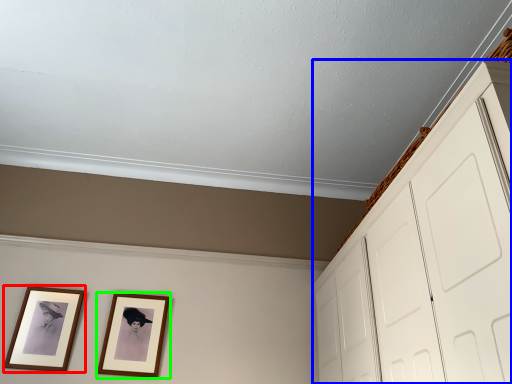
Question: Based on their relative distances, which object is farther from picture frame (highlighted by a red box)? Choose from dresser (highlighted by a blue box) and picture frame (highlighted by a green box).

Choices:
 (A) dresser
 (B) picture frame

Answer: (A)